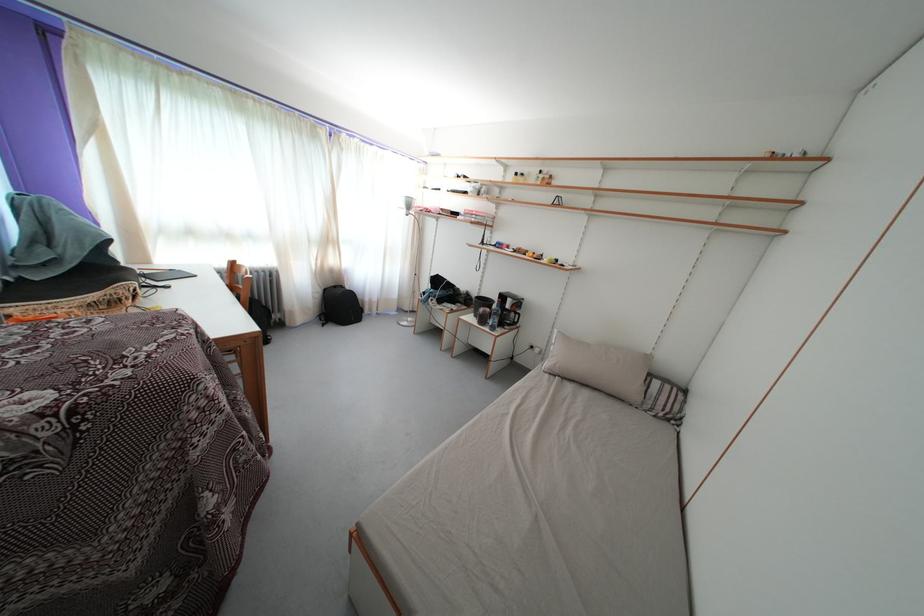
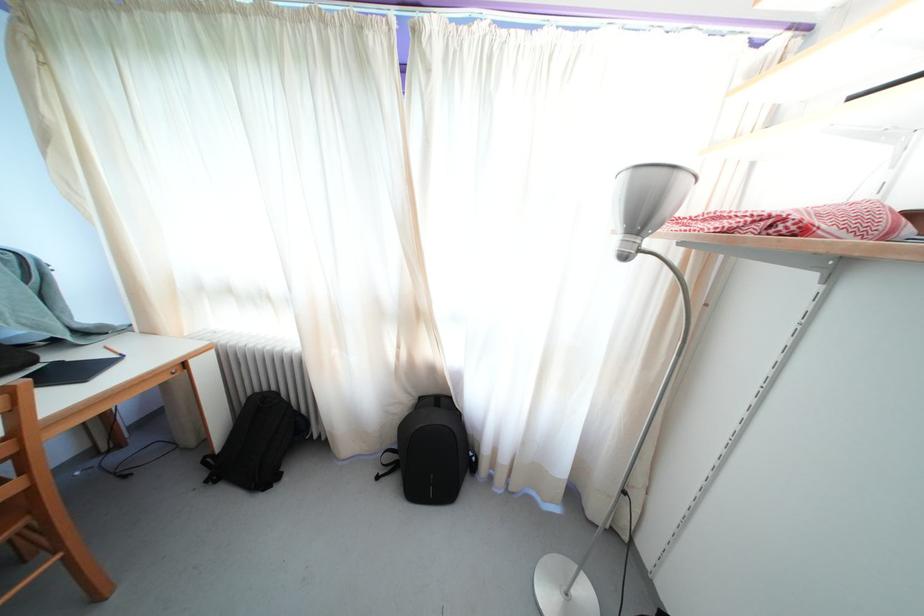
In the second image, find the point that corresponds to pixel 335 246 in the first image.

(421, 321)